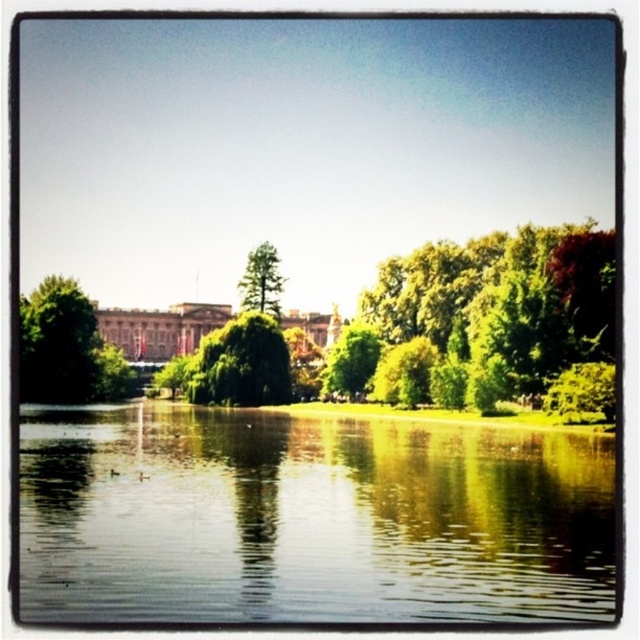
Does green leafy tree at center appear over green matte tree at center?

No, green leafy tree at center is not above green matte tree at center.

Who is more forward, [349,323] or [272,288]?

Point [272,288] is more forward.

Which is in front, point (356, 356) or point (264, 272)?

Point (356, 356)

This screenshot has width=640, height=640. I want to click on green leafy tree at center, so click(x=349, y=360).

Does green leafy tree at upper right have a greater height compared to brown stone palace at center?

Indeed, green leafy tree at upper right has a greater height compared to brown stone palace at center.

Is the position of green leafy tree at upper right less distant than that of brown stone palace at center?

Yes, it is.

Is point (572, 328) closer to camera compared to point (221, 310)?

That is True.

The image size is (640, 640). Identify the location of green leafy tree at upper right. 481,317.

Can you confirm if green leafy tree at upper right is shorter than green leafy tree at left?

In fact, green leafy tree at upper right may be taller than green leafy tree at left.

Image resolution: width=640 pixels, height=640 pixels. What do you see at coordinates (481, 317) in the screenshot? I see `green leafy tree at upper right` at bounding box center [481, 317].

This screenshot has height=640, width=640. Identify the location of green leafy tree at upper right. (481, 317).